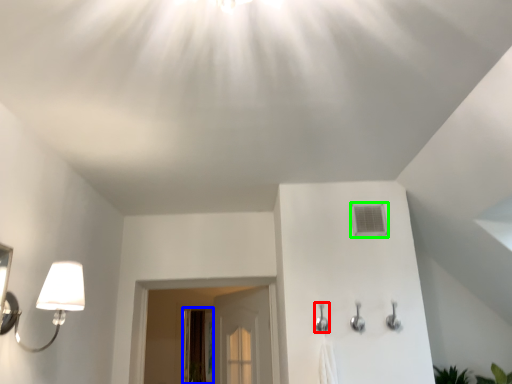
Question: Estimate the real-world distances between objects in this image. Which object is closer to shower (highlighted by a red box), screen door (highlighted by a blue box) or air conditioner (highlighted by a green box)?

Choices:
 (A) screen door
 (B) air conditioner

Answer: (B)